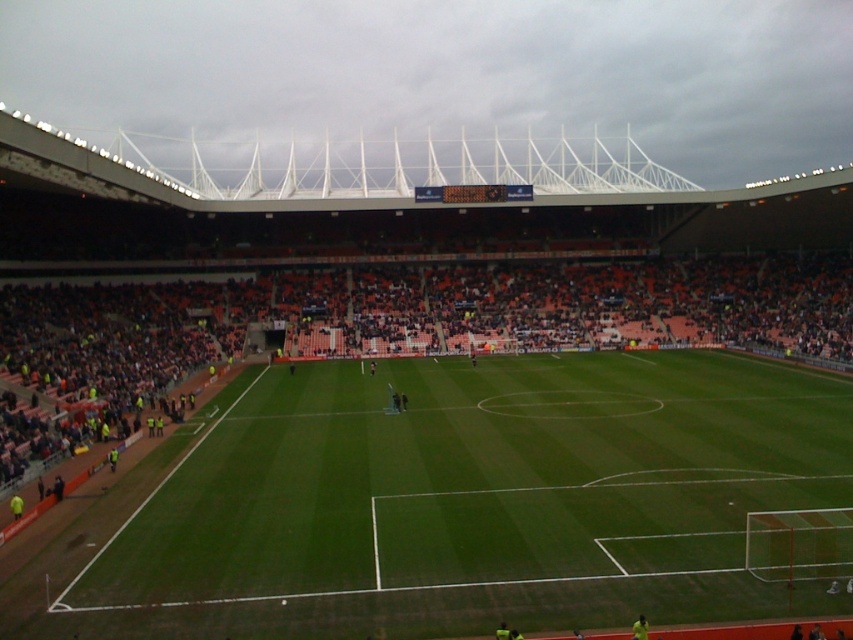
Question: Does green grass football field at center appear on the left side of orange plastic seats at center?

Choices:
 (A) no
 (B) yes

Answer: (B)

Question: Does green grass football field at center have a smaller size compared to orange plastic seats at center?

Choices:
 (A) yes
 (B) no

Answer: (A)

Question: Which point is closer to the camera?

Choices:
 (A) orange plastic seats at center
 (B) green grass football field at center

Answer: (B)

Question: Where is green grass football field at center located in relation to orange plastic seats at center in the image?

Choices:
 (A) above
 (B) below

Answer: (B)